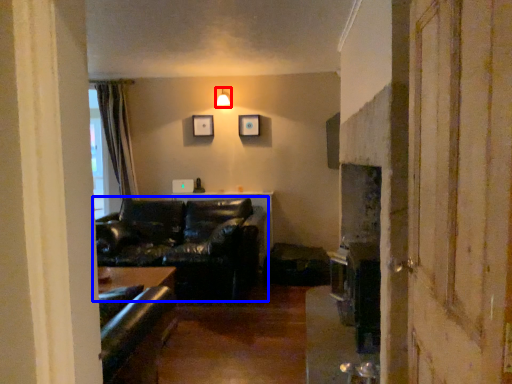
Question: Which object appears farthest to the camera in this image, light fixture (highlighted by a red box) or studio couch (highlighted by a blue box)?

Choices:
 (A) light fixture
 (B) studio couch

Answer: (A)